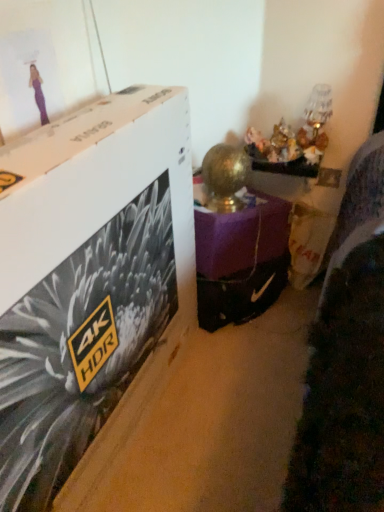
Question: Based on their sizes in the image, would you say white cardboard box at upper left is bigger or smaller than purple matte lamp at center?

Choices:
 (A) small
 (B) big

Answer: (B)

Question: Looking at their shapes, would you say white cardboard box at upper left is wider or thinner than purple matte lamp at center?

Choices:
 (A) wide
 (B) thin

Answer: (B)

Question: From their relative heights in the image, would you say white cardboard box at upper left is taller or shorter than purple matte lamp at center?

Choices:
 (A) tall
 (B) short

Answer: (A)

Question: Visually, is purple matte lamp at center positioned to the left or to the right of white cardboard box at upper left?

Choices:
 (A) left
 (B) right

Answer: (B)

Question: In the image, is purple matte lamp at center positioned in front of or behind white cardboard box at upper left?

Choices:
 (A) front
 (B) behind

Answer: (B)

Question: Is purple matte lamp at center inside or outside of white cardboard box at upper left?

Choices:
 (A) outside
 (B) inside

Answer: (A)

Question: Considering the positions of purple matte lamp at center and white cardboard box at upper left in the image, is purple matte lamp at center wider or thinner than white cardboard box at upper left?

Choices:
 (A) wide
 (B) thin

Answer: (A)